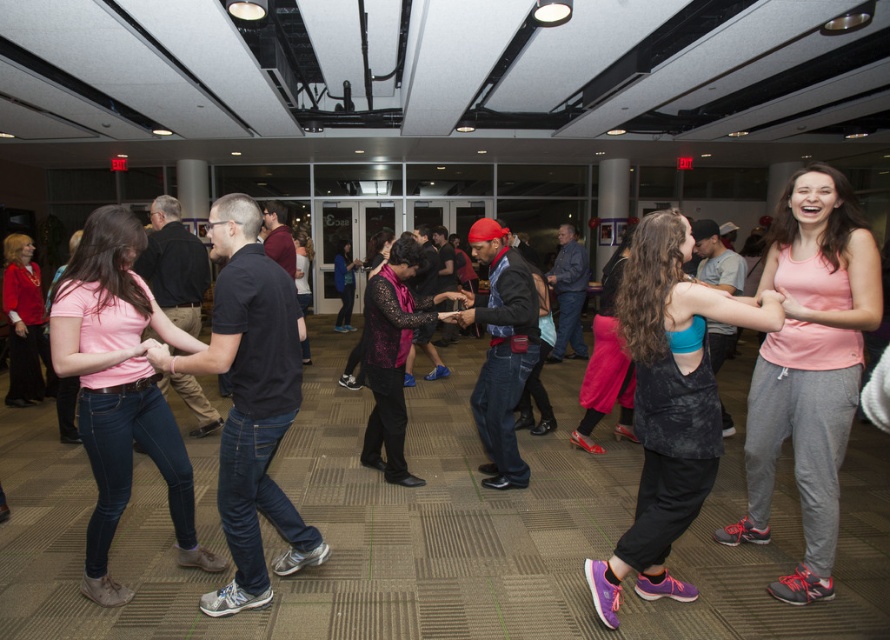
Locate an element on the screen. This screenshot has width=890, height=640. matte black tank top at center is located at coordinates (668, 404).

Which of these two, matte black tank top at center or pink matte t-shirt at center, stands taller?

Standing taller between the two is pink matte t-shirt at center.

Is point (733, 317) closer to camera compared to point (158, 397)?

Yes.

Locate an element on the screen. matte black tank top at center is located at coordinates (668, 404).

Is pink tank top at center bigger than pink fabric dress at center?

No.

Does pink tank top at center appear on the right side of pink fabric dress at center?

Indeed, pink tank top at center is positioned on the right side of pink fabric dress at center.

Between point (876, 269) and point (613, 280), which one is positioned in front?

Point (876, 269)

Locate an element on the screen. pink tank top at center is located at coordinates coord(808,368).

Can you confirm if pink matte t-shirt at center is positioned to the left of black lace dress at center?

Indeed, pink matte t-shirt at center is positioned on the left side of black lace dress at center.

Between pink matte t-shirt at center and black lace dress at center, which one is positioned lower?

pink matte t-shirt at center

This screenshot has width=890, height=640. Identify the location of pink matte t-shirt at center. [x=120, y=388].